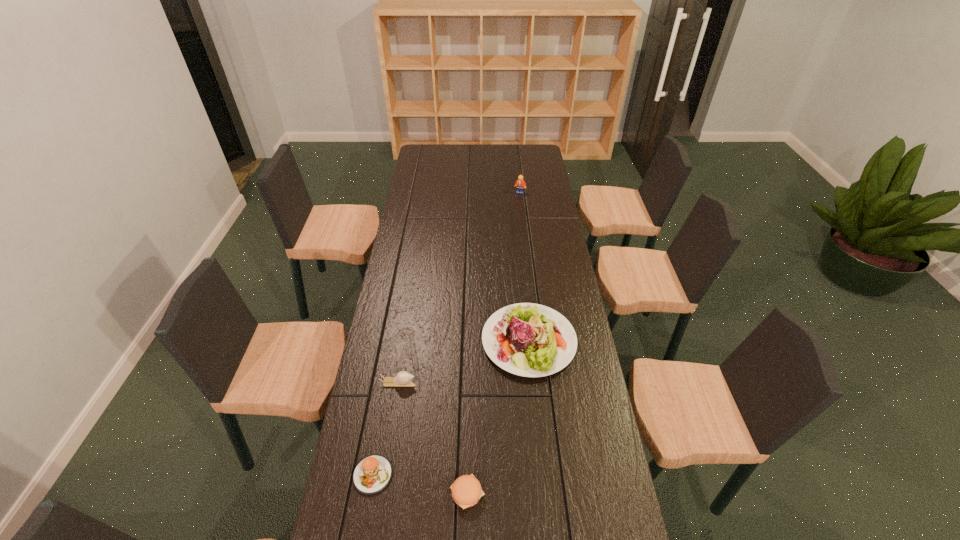
The image size is (960, 540). Identify the location of the farthest object. (520, 184).

Locate an element on the screen. The height and width of the screenshot is (540, 960). the tallest object is located at coordinates (520, 184).

At what (x,y) coordinates should I click in order to perform the action: click on the second tallest object. Please return your answer as a coordinate pair (x, y). This screenshot has width=960, height=540. Looking at the image, I should click on (526, 339).

The width and height of the screenshot is (960, 540). I want to click on escargot, so click(x=403, y=379).

Locate an element on the screen. the left patty is located at coordinates (372, 474).

At what (x,y) coordinates should I click in order to perform the action: click on the right patty. Please return your answer as a coordinate pair (x, y). The height and width of the screenshot is (540, 960). Looking at the image, I should click on (466, 491).

What are the coordinates of `vacant region located 0.180m on the front-facing side of the Lego` in the screenshot? It's located at (522, 214).

Image resolution: width=960 pixels, height=540 pixels. In order to click on vacant area located 0.130m on the left of the salad plate in this screenshot , I will do `click(445, 341)`.

Where is `free space located 0.260m on the shell of the third tallest object`? free space located 0.260m on the shell of the third tallest object is located at coordinates (495, 383).

Image resolution: width=960 pixels, height=540 pixels. Find the location of `vacant space located 0.200m on the back of the left patty`. vacant space located 0.200m on the back of the left patty is located at coordinates (387, 395).